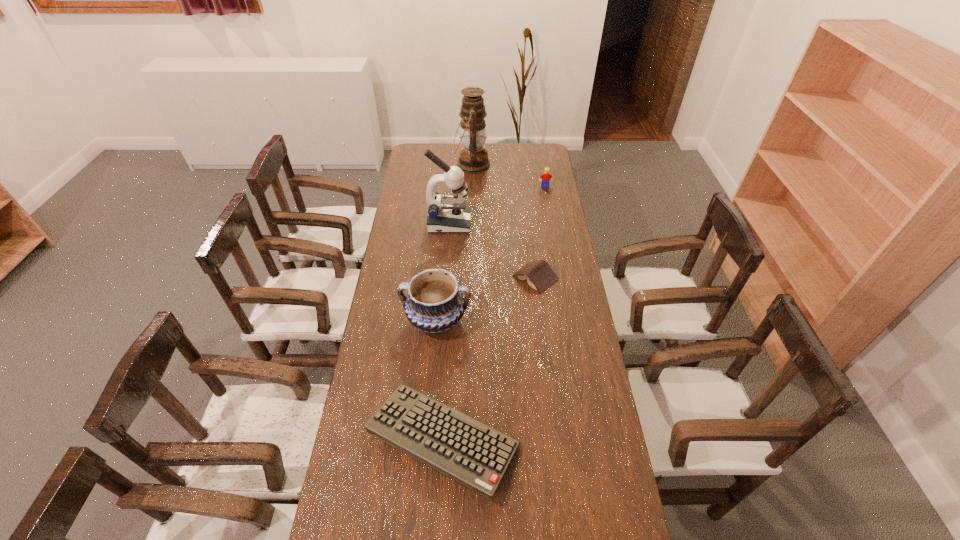
I want to click on Lego positioned at the right edge, so click(x=546, y=176).

Identify the location of book located at the right edge. Image resolution: width=960 pixels, height=540 pixels. (539, 275).

The width and height of the screenshot is (960, 540). I want to click on free space at the far edge, so (500, 157).

Locate an element on the screen. blank space at the left edge of the desktop is located at coordinates (427, 236).

You are a GUI agent. You are given a task and a screenshot of the screen. Output one action in this format:
    pyautogui.click(x=<x>, y=<y>)
    Task: Click on the free point at the right edge
    This screenshot has width=960, height=540.
    Given the screenshot: What is the action you would take?
    pyautogui.click(x=579, y=464)

Find the location of `vacant space at the far right corner`. vacant space at the far right corner is located at coordinates (548, 150).

Where is `vacant region between the fifth nearest object and the shortest object`? This screenshot has height=540, width=960. vacant region between the fifth nearest object and the shortest object is located at coordinates pos(540,232).

The width and height of the screenshot is (960, 540). I want to click on free spot between the computer keyboard and the fourth farthest object, so click(x=489, y=359).

Where is `vacant space in between the book and the second nearest object`? The image size is (960, 540). vacant space in between the book and the second nearest object is located at coordinates (486, 299).

Image resolution: width=960 pixels, height=540 pixels. What are the coordinates of `empty location between the lantern and the fourth farthest object` in the screenshot? It's located at (503, 221).